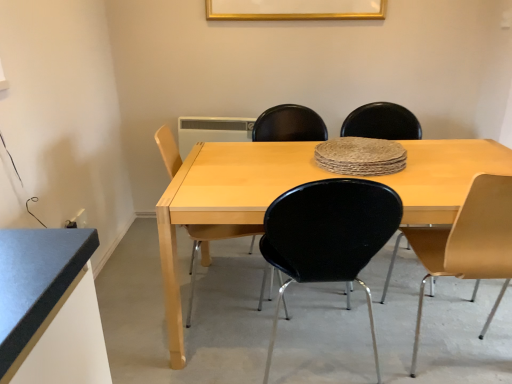
Image resolution: width=512 pixels, height=384 pixels. What are the coordinates of `free space behind matte yellow chair at right, which appears as the 4th chair when viewed from the left` in the screenshot? It's located at (426, 295).